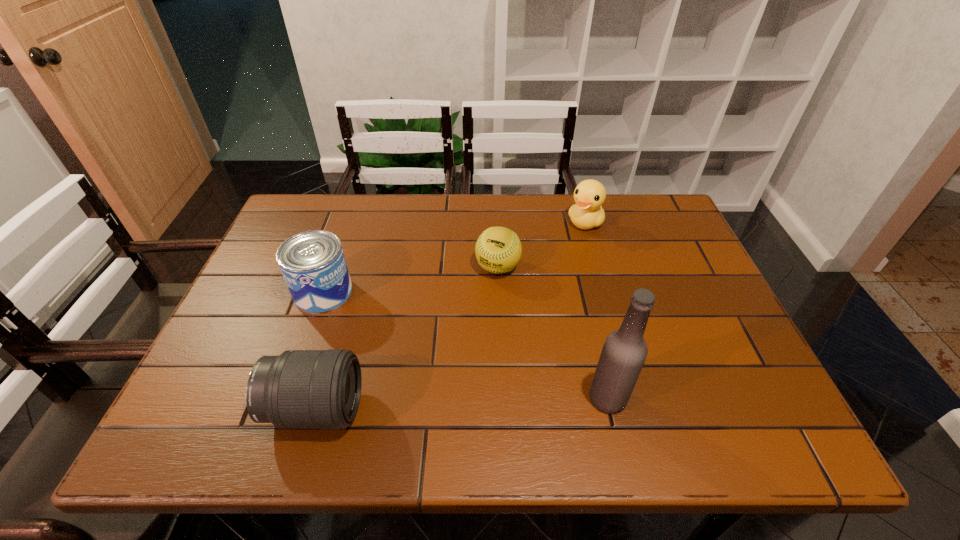
Where is `vacant space that satisfies the following two spatial constraints: 1. on the back side of the can; 2. on the left side of the softball`? vacant space that satisfies the following two spatial constraints: 1. on the back side of the can; 2. on the left side of the softball is located at coordinates (332, 267).

At what (x,y) coordinates should I click in order to perform the action: click on vacant space that satisfies the following two spatial constraints: 1. on the back side of the third object from right to left; 2. on the right side of the can. Please return your answer as a coordinate pair (x, y). Looking at the image, I should click on (332, 267).